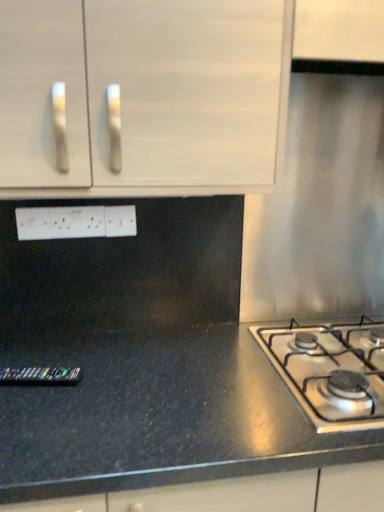
Question: From the image's perspective, is black granite countertop at lower left positioned above or below white plastic electrical outlet at center, which is the 2th electric outlet from right to left?

Choices:
 (A) below
 (B) above

Answer: (A)

Question: From their relative heights in the image, would you say black granite countertop at lower left is taller or shorter than white plastic electrical outlet at center, which is the 2th electric outlet from right to left?

Choices:
 (A) short
 (B) tall

Answer: (B)

Question: Estimate the real-world distances between objects in this image. Which object is closer to the satin silver gas stove at lower right?

Choices:
 (A) white matte cabinet at upper left
 (B) white plastic electrical outlet at center, which is the 2th electric outlet from right to left
 (C) white plastic electric outlet at center, the first electric outlet in the right-to-left sequence
 (D) black granite countertop at lower left

Answer: (D)

Question: Estimate the real-world distances between objects in this image. Which object is farther from the black granite countertop at lower left?

Choices:
 (A) white plastic electrical outlet at center, marked as the first electric outlet in a left-to-right arrangement
 (B) white plastic electric outlet at center, the first electric outlet in the right-to-left sequence
 (C) satin silver gas stove at lower right
 (D) white matte cabinet at upper left

Answer: (D)